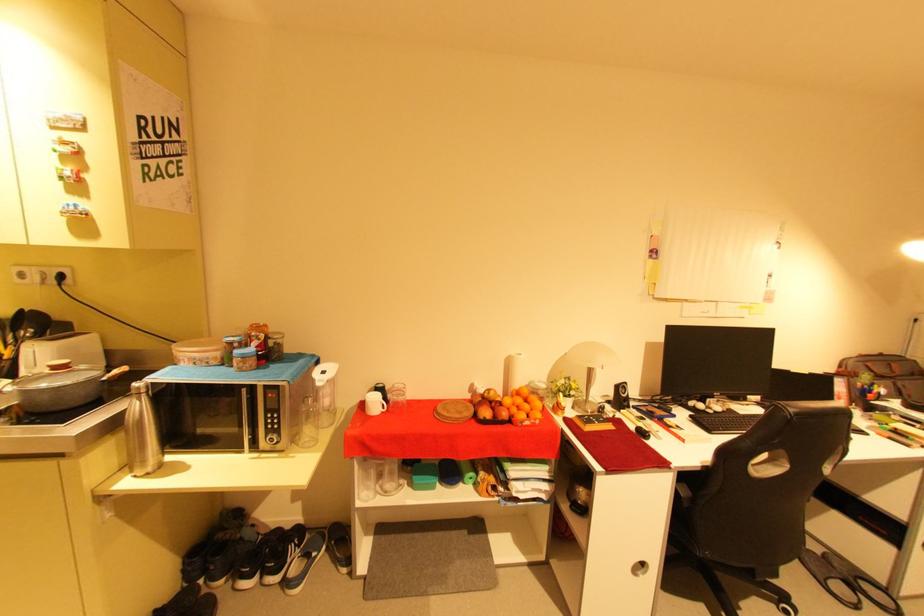
The image size is (924, 616). Describe the element at coordinates (682, 531) in the screenshot. I see `the chair sitting surface` at that location.